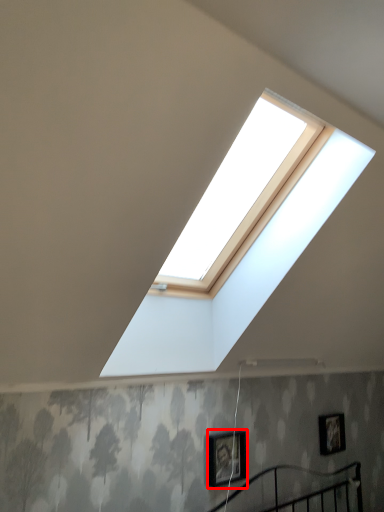
Question: Considering the relative positions of picture frame (annotated by the red box) and picture frame in the image provided, where is picture frame (annotated by the red box) located with respect to the staircase?

Choices:
 (A) right
 (B) left

Answer: (B)